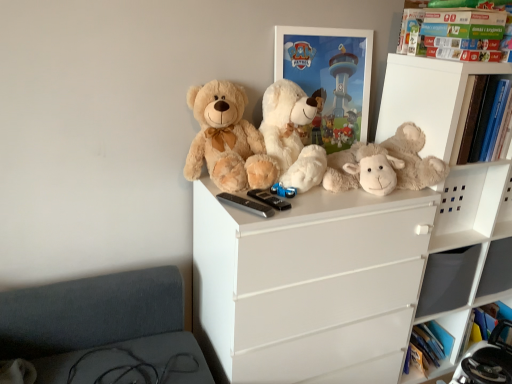
Question: From their relative heights in the image, would you say green cardboard book at upper right is taller or shorter than white glossy picture frame at upper center?

Choices:
 (A) tall
 (B) short

Answer: (B)

Question: Is green cardboard book at upper right bigger or smaller than white glossy picture frame at upper center?

Choices:
 (A) big
 (B) small

Answer: (B)

Question: Considering the real-world distances, which object is farthest from the white matte shelf at upper right?

Choices:
 (A) fluffy beige teddy bear at upper center, which appears as the first teddy bear when viewed from the left
 (B) fluffy white teddy bear at upper center, the 2th teddy bear positioned from the right
 (C) green cardboard book at upper right
 (D) white glossy picture frame at upper center
 (E) fluffy beige teddy bear at center, marked as the 3th teddy bear in a left-to-right arrangement

Answer: (A)

Question: Which object is the closest to the fluffy beige teddy bear at upper center, the 3th teddy bear from the right?

Choices:
 (A) fluffy white teddy bear at upper center, the 2th teddy bear positioned from the right
 (B) white matte shelf at upper right
 (C) fluffy beige teddy bear at center, marked as the 3th teddy bear in a left-to-right arrangement
 (D) green cardboard book at upper right
 (E) white glossy picture frame at upper center

Answer: (A)